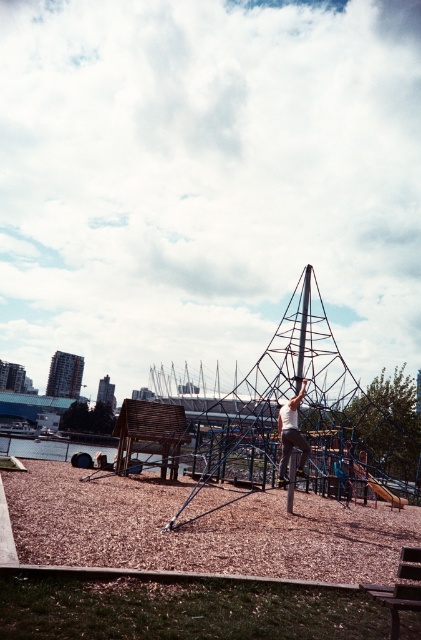
How much distance is there between wooden park bench at lower right and white matte shirt at center?

The distance of wooden park bench at lower right from white matte shirt at center is 30.87 feet.

Can you confirm if wooden park bench at lower right is positioned to the right of white matte shirt at center?

Correct, you'll find wooden park bench at lower right to the right of white matte shirt at center.

Describe the element at coordinates (394, 600) in the screenshot. The image size is (421, 640). I see `wooden park bench at lower right` at that location.

Locate an element on the screen. wooden park bench at lower right is located at coordinates (394, 600).